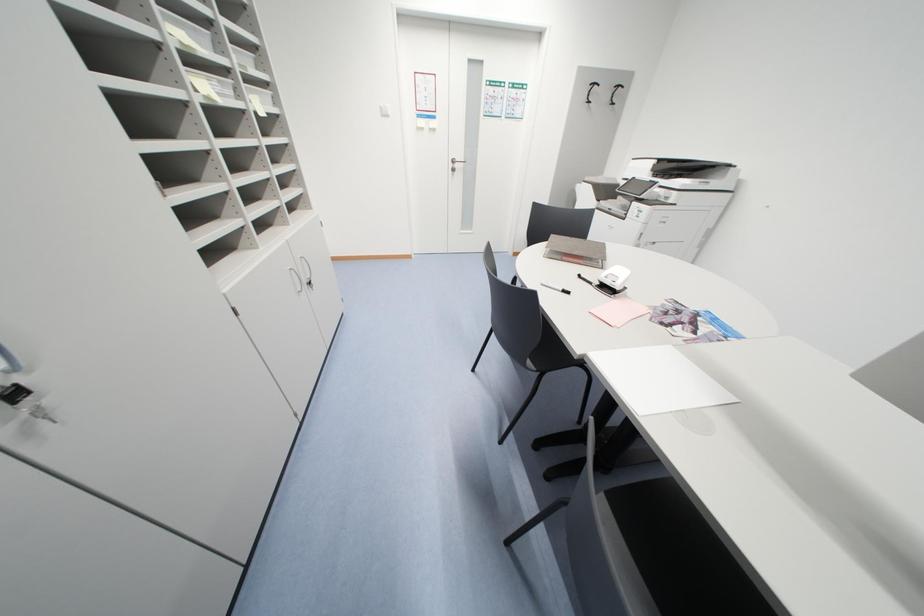
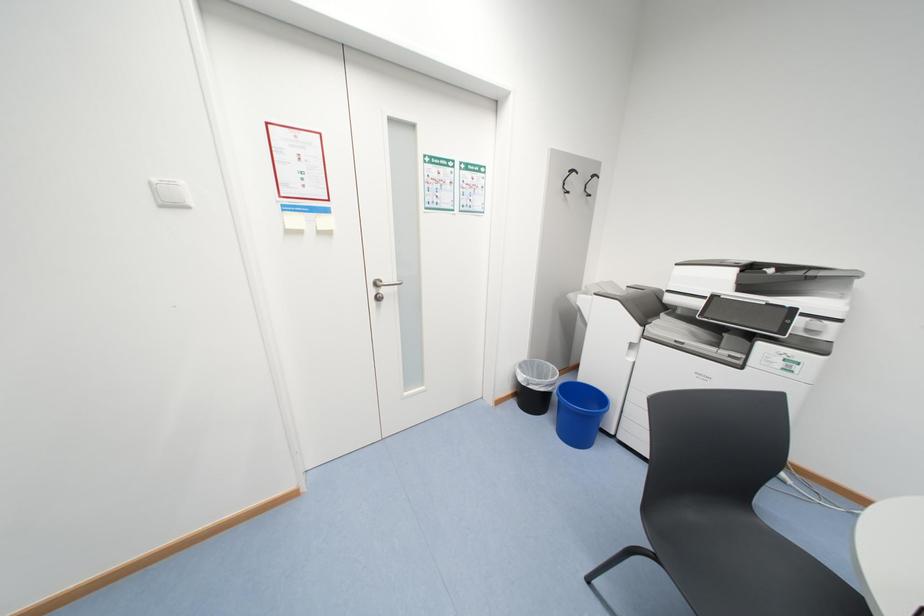
Question: The images are taken continuously from a first-person perspective. In which direction are you moving?

Choices:
 (A) Left
 (B) Right
 (C) Forward
 (D) Backward

Answer: (C)